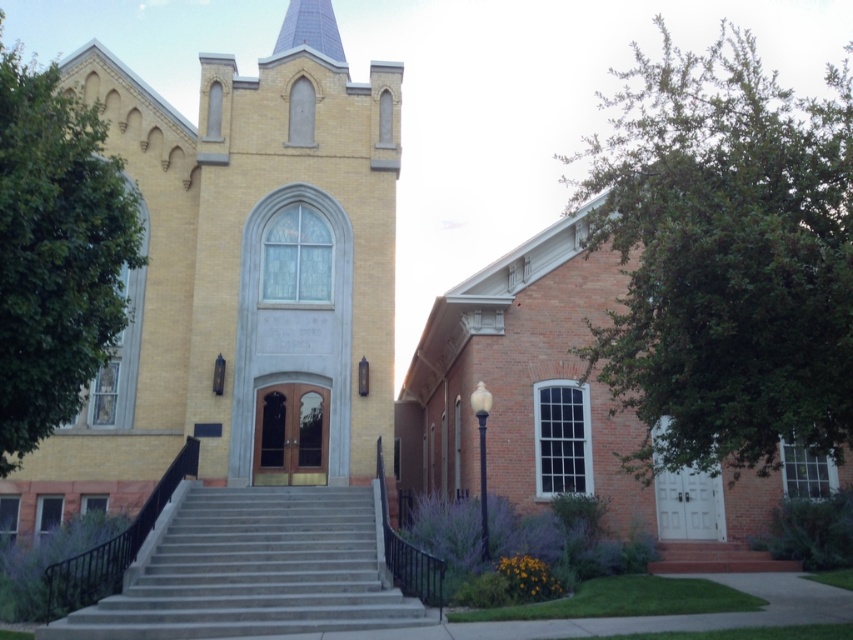
Question: Where is yellow brick church at center located in relation to green leafy tree at left in the image?

Choices:
 (A) above
 (B) below

Answer: (B)

Question: Which point appears closest to the camera in this image?

Choices:
 (A) tap(321, 17)
 (B) tap(277, 529)
 (C) tap(76, 369)

Answer: (C)

Question: Does green leafy tree at right have a greater width compared to green leafy tree at left?

Choices:
 (A) yes
 (B) no

Answer: (A)

Question: Which point is closer to the camera taking this photo?

Choices:
 (A) (318, 1)
 (B) (32, 298)
 (C) (344, 317)

Answer: (B)

Question: Does gray concrete stairs at center appear on the right side of shiny blue spire at upper center?

Choices:
 (A) yes
 (B) no

Answer: (A)

Question: Which object appears farthest from the camera in this image?

Choices:
 (A) gray concrete stairs at center
 (B) green leafy tree at left
 (C) shiny blue spire at upper center
 (D) yellow brick church at center

Answer: (C)